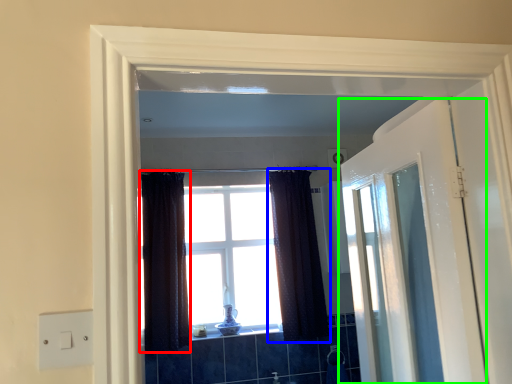
Question: Which object is positioned closest to curtain (highlighted by a red box)? Select from curtain (highlighted by a blue box) and door (highlighted by a green box).

Choices:
 (A) curtain
 (B) door

Answer: (A)